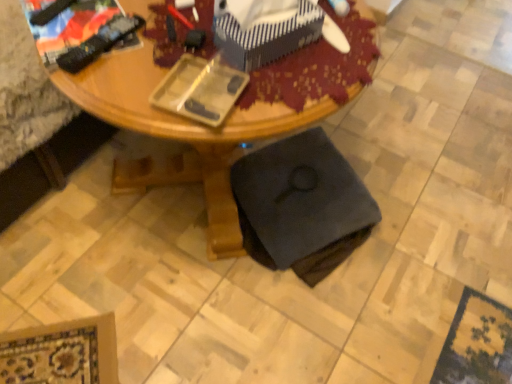
Find the location of `vacant area located to the right-hand side of wooden desk at center`. vacant area located to the right-hand side of wooden desk at center is located at coordinates (421, 192).